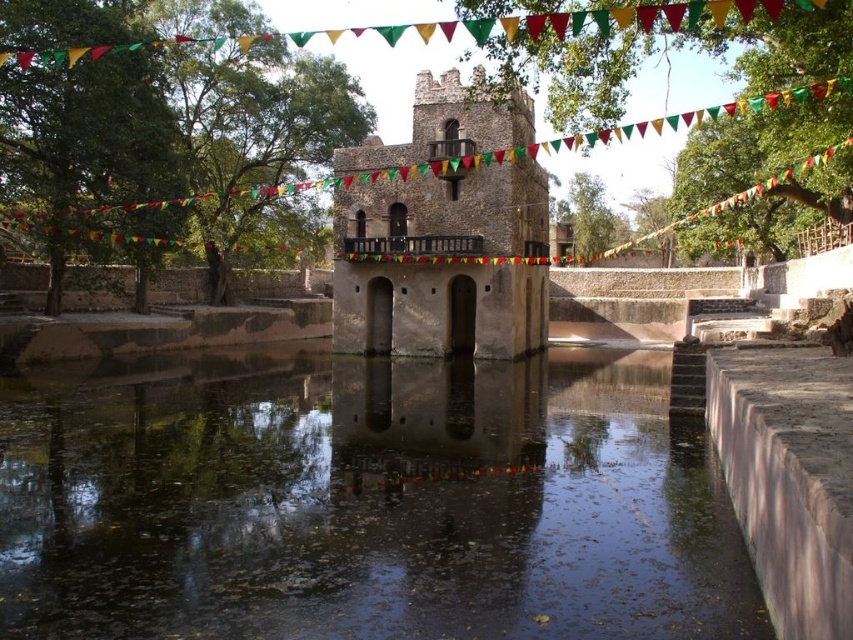
Is brown concrete river at center shorter than brown stone tower at center?

Yes.

Between brown concrete river at center and brown stone tower at center, which one is positioned lower?

brown concrete river at center is below.

Locate an element on the screen. The height and width of the screenshot is (640, 853). brown concrete river at center is located at coordinates (364, 502).

The width and height of the screenshot is (853, 640). In order to click on brown concrete river at center in this screenshot , I will do `click(364, 502)`.